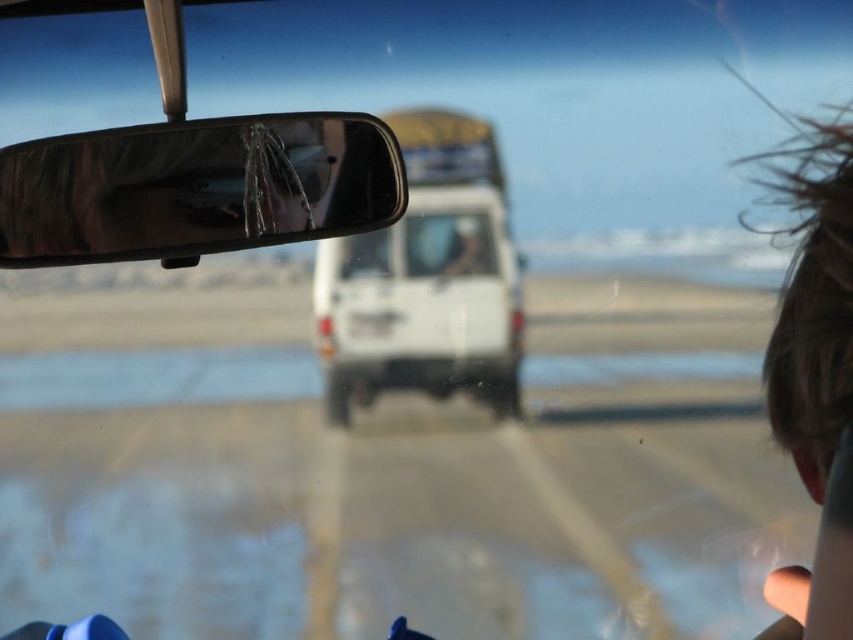
Question: Which point is closer to the camera?

Choices:
 (A) white matte van at center
 (B) transparent glass car window at center
 (C) shiny chrome mirror at upper center
 (D) brown hair at upper right

Answer: (D)

Question: Does shiny chrome mirror at upper center have a lesser width compared to brown hair at upper right?

Choices:
 (A) yes
 (B) no

Answer: (B)

Question: Which object is farther from the camera taking this photo?

Choices:
 (A) white matte van at center
 (B) brown hair at upper right
 (C) transparent glass car window at center

Answer: (C)

Question: Is white matte van at center below brown hair at upper right?

Choices:
 (A) no
 (B) yes

Answer: (A)

Question: Which point is farther to the camera?

Choices:
 (A) white matte van at center
 (B) shiny chrome mirror at upper center

Answer: (A)

Question: Does shiny chrome mirror at upper center appear on the right side of white matte van at center?

Choices:
 (A) yes
 (B) no

Answer: (B)